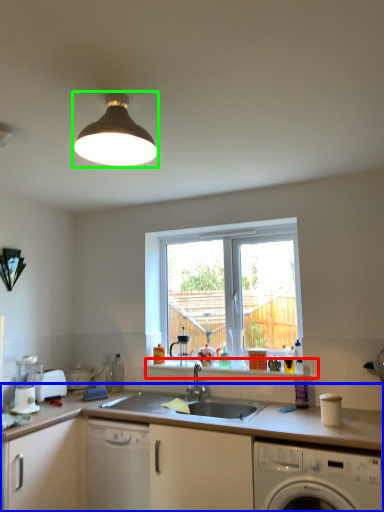
Question: Considering the real-world distances, which object is closest to window sill (highlighted by a red box)? countertop (highlighted by a blue box) or light fixture (highlighted by a green box).

Choices:
 (A) countertop
 (B) light fixture

Answer: (A)